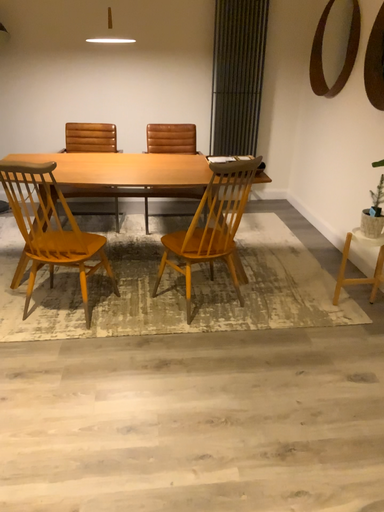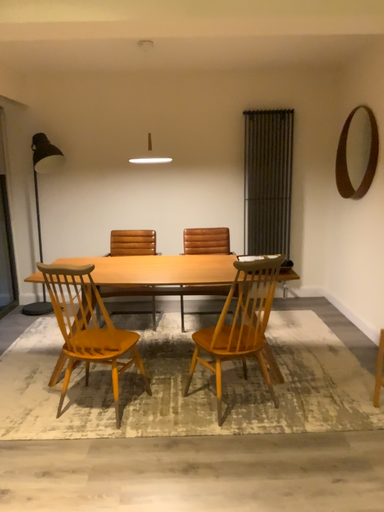
Question: Which way did the camera rotate in the video?

Choices:
 (A) rotated right
 (B) rotated left

Answer: (B)